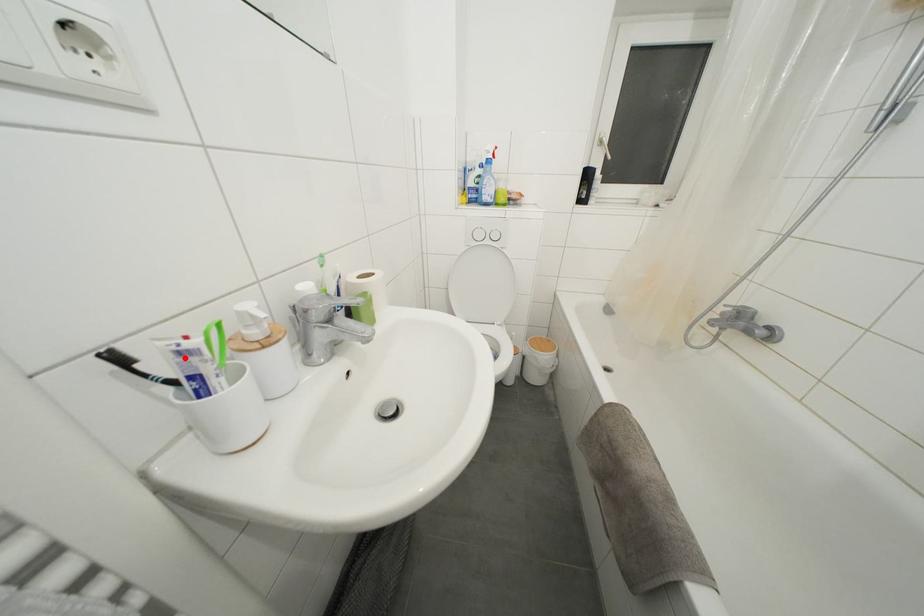
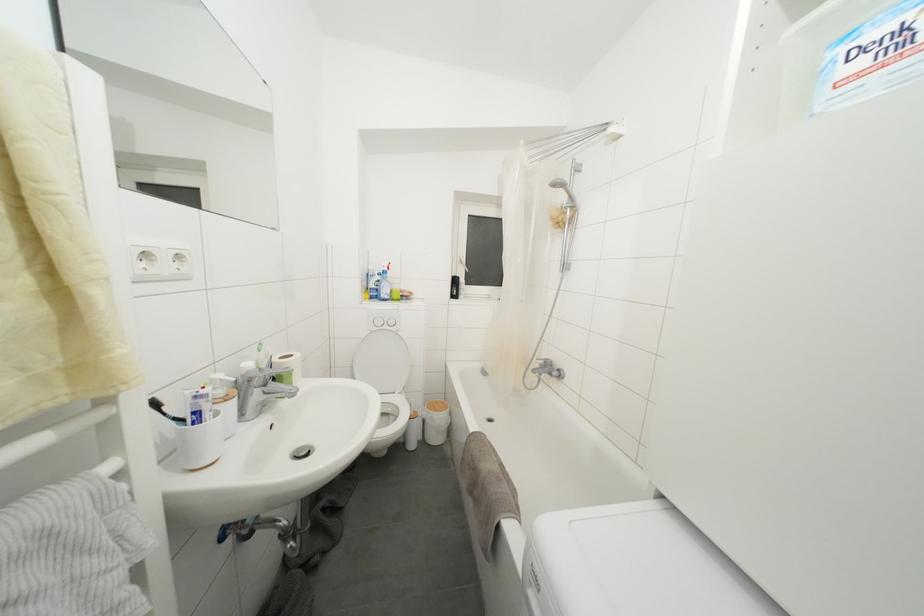
The point at the highlighted location is marked in the first image. Where is the corresponding point in the second image?

(200, 402)